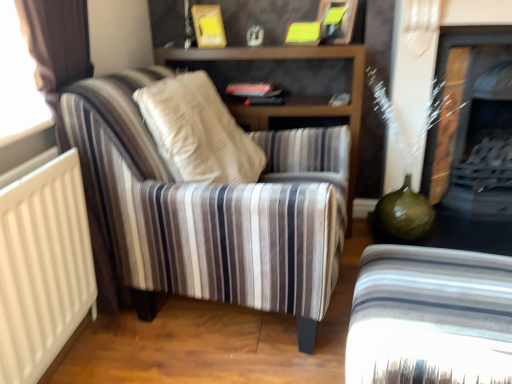
Question: From a real-world perspective, is matte black fireplace at right above or below striped fabric armchair at lower right, which is the 2th chair from left to right?

Choices:
 (A) above
 (B) below

Answer: (A)

Question: Is matte black fireplace at right in front of or behind striped fabric armchair at lower right, which is the 2th chair from left to right, in the image?

Choices:
 (A) behind
 (B) front

Answer: (A)

Question: Considering the real-world distances, which object is farthest from the striped fabric armchair at left, which is the 2th chair from right to left?

Choices:
 (A) striped fabric armchair at lower right, which is the 2th chair from left to right
 (B) matte black fireplace at right

Answer: (B)

Question: Which object is the farthest from the striped fabric armchair at left, which ranks as the 1th chair in left-to-right order?

Choices:
 (A) matte black fireplace at right
 (B) striped fabric armchair at lower right, the 1th chair from the right

Answer: (A)